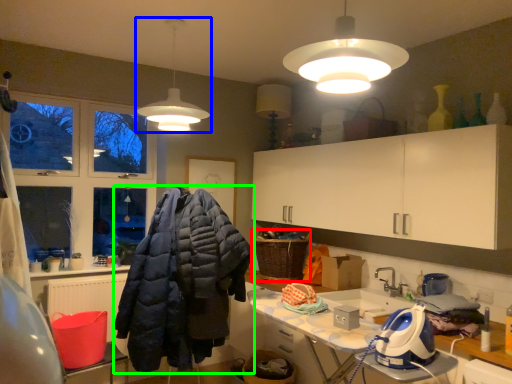
Question: Estimate the real-world distances between objects in this image. Which object is closer to laundry basket (highlighted by a red box), lamp (highlighted by a blue box) or jacket (highlighted by a green box)?

Choices:
 (A) lamp
 (B) jacket

Answer: (B)